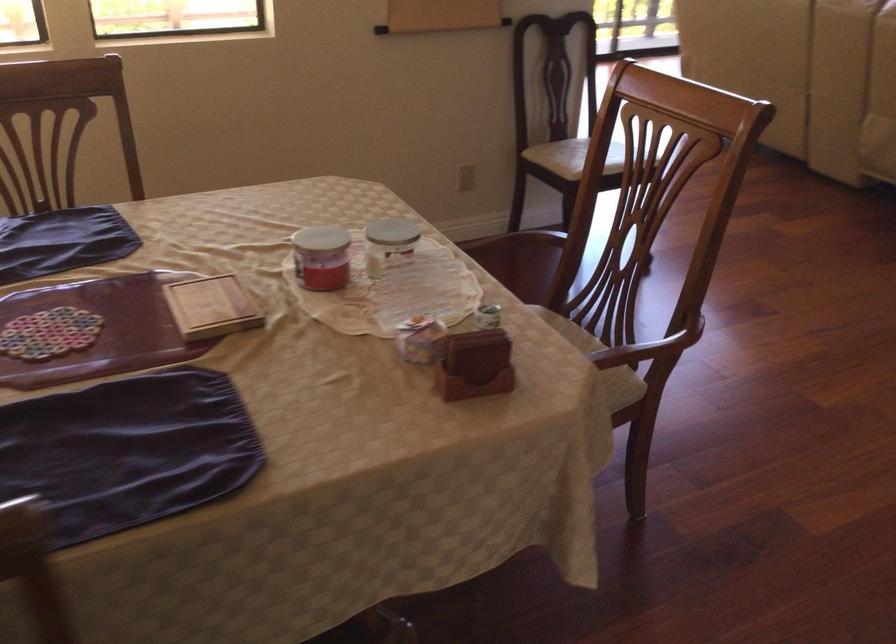
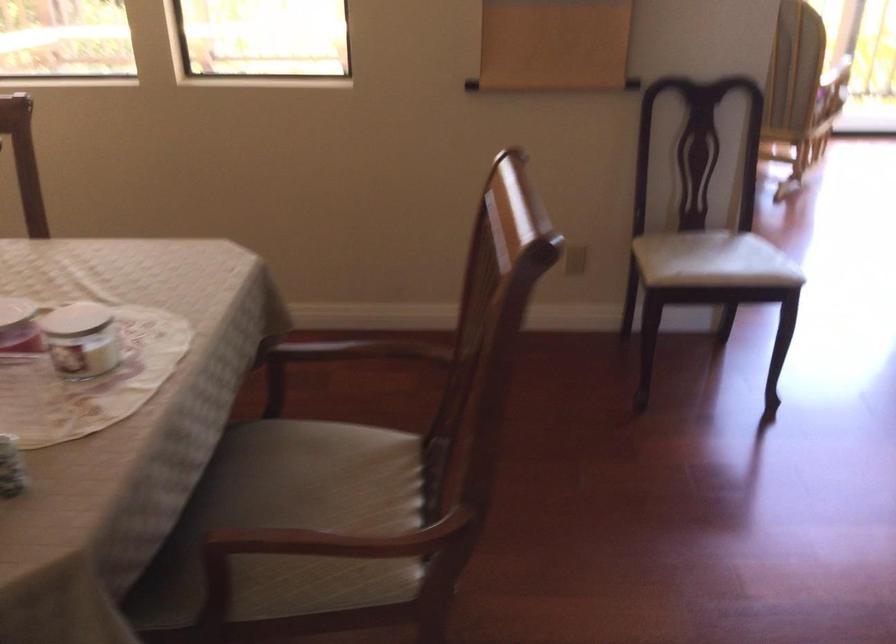
The images are taken continuously from a first-person perspective. In which direction are you moving?

The cameraman moved toward right, forward.